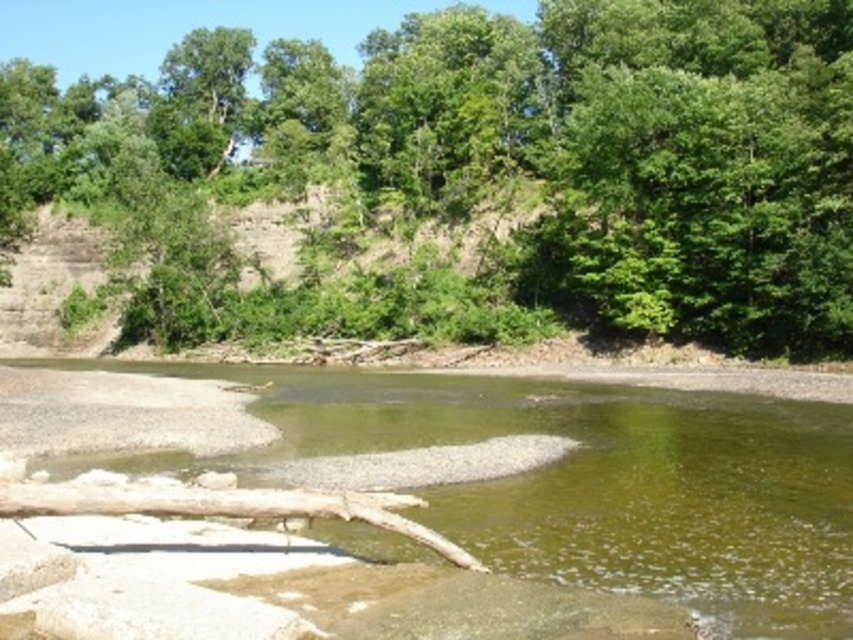
Question: Considering the relative positions of green leafy tree at center and green sedimentary rock at center in the image provided, where is green leafy tree at center located with respect to green sedimentary rock at center?

Choices:
 (A) above
 (B) below

Answer: (A)

Question: Which of the following is the closest to the observer?

Choices:
 (A) green leafy tree at center
 (B) brown wood log at lower center
 (C) green sedimentary rock at center

Answer: (C)

Question: Does green leafy tree at center have a smaller size compared to brown wood log at lower center?

Choices:
 (A) no
 (B) yes

Answer: (A)

Question: Does green leafy tree at center appear over green sedimentary rock at center?

Choices:
 (A) no
 (B) yes

Answer: (B)

Question: Which of these objects is positioned farthest from the brown wood log at lower center?

Choices:
 (A) green sedimentary rock at center
 (B) green leafy tree at center

Answer: (B)

Question: Which is farther from the green leafy tree at center?

Choices:
 (A) green sedimentary rock at center
 (B) brown wood log at lower center

Answer: (B)